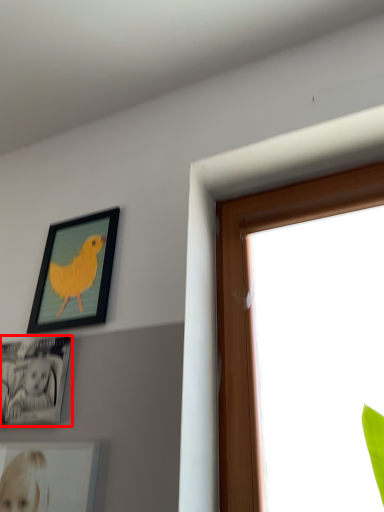
Question: From the image's perspective, what is the correct spatial relationship of picture frame (annotated by the red box) in relation to picture frame?

Choices:
 (A) above
 (B) below

Answer: (B)